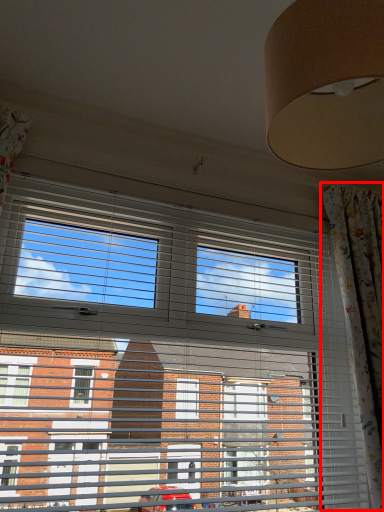
Question: From the image's perspective, where is curtain (annotated by the red box) located relative to window?

Choices:
 (A) below
 (B) above

Answer: (A)